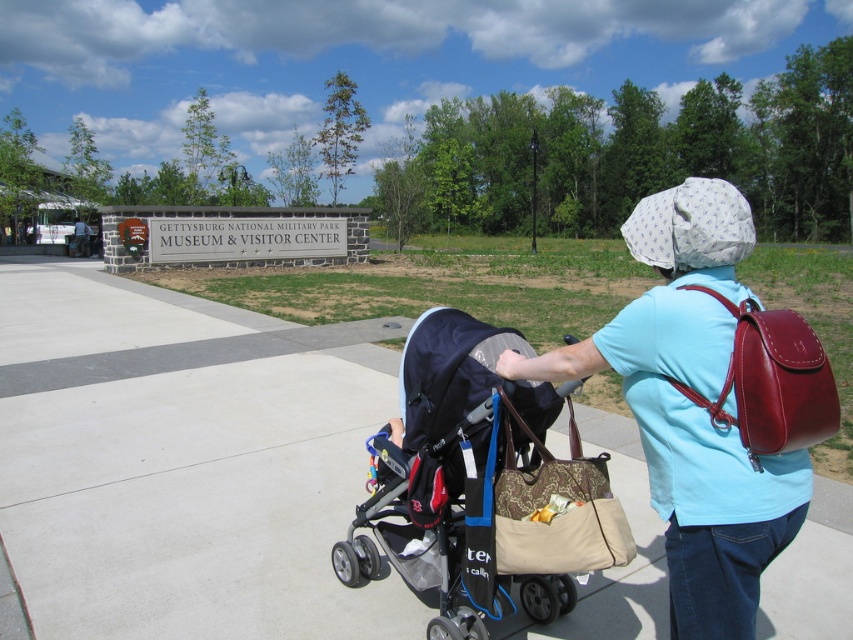
You are a photographer planning to take a picture of the museum entrance. You have two items in your viewfinder, the beige fabric tote at center and the shiny burgundy leather backpack at upper right. Which item should you focus on if you want to capture the wider object in your shot?

The shiny burgundy leather backpack at upper right is wider than the beige fabric tote at center, so you should focus on the shiny burgundy leather backpack at upper right to capture the wider object in your shot.

You are a visitor at the Gettysburg National Military Park Museum. You see a dark blue fabric stroller at center and a shiny burgundy leather backpack at upper right. Which object is positioned to the left when viewed from your perspective?

The dark blue fabric stroller at center is positioned to the left of the shiny burgundy leather backpack at upper right.